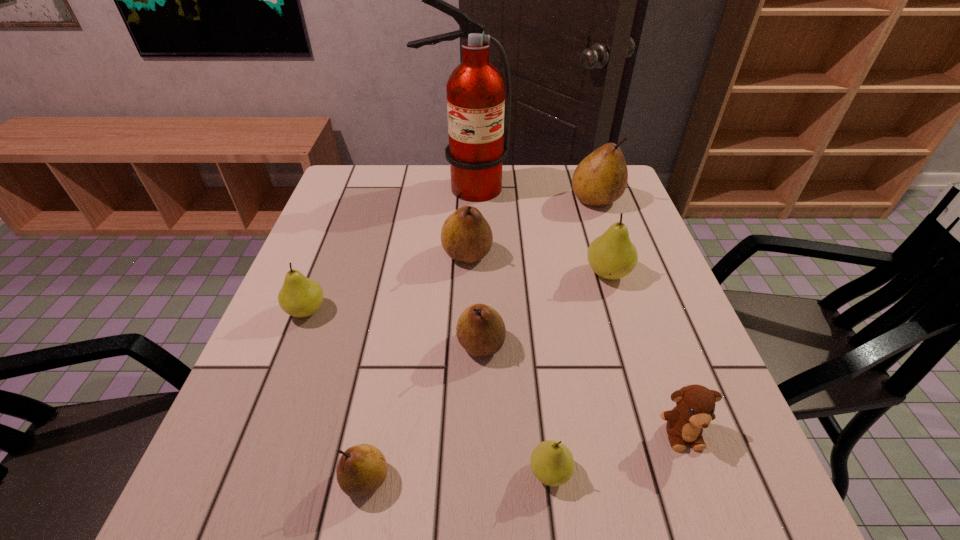
This screenshot has width=960, height=540. Identify the location of free space at the left edge of the desktop. (336, 259).

Locate an element on the screen. free region at the right edge of the desktop is located at coordinates (658, 365).

The width and height of the screenshot is (960, 540). I want to click on vacant position at the far left corner of the desktop, so coord(331,205).

This screenshot has width=960, height=540. Identify the location of free space at the near left corner of the desktop. (280, 504).

Identify the location of free space between the leftmost pear and the second pear from left to right. (336, 395).

What are the coordinates of `vacant area between the second tallest object and the tallest object` in the screenshot? It's located at [x=530, y=194].

Find the location of a particular element. The image size is (960, 540). unoccupied area between the second farthest brown pear and the biggest brown pear is located at coordinates (532, 227).

Locate an element on the screen. The image size is (960, 540). unoccupied position between the leftmost object and the teddy bear is located at coordinates (494, 372).

This screenshot has width=960, height=540. Identify the location of unoccupied position between the tallest object and the second nearest green pear. tap(386, 249).

Locate an element on the screen. free point between the third pear from right to left and the leftmost brown pear is located at coordinates (458, 476).